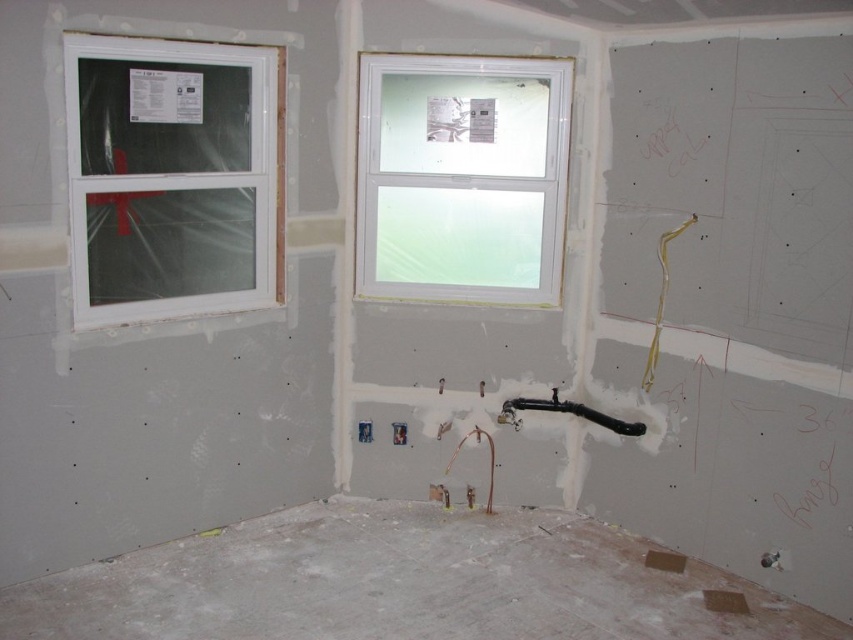
Is white plastic window at left above white plastic window at upper center?

Actually, white plastic window at left is below white plastic window at upper center.

Who is more distant from viewer, [209,234] or [401,93]?

Point [401,93]

Which is in front, point (161, 307) or point (428, 90)?

Point (161, 307) is in front.

This screenshot has height=640, width=853. What are the coordinates of `white plastic window at left` in the screenshot? It's located at (173, 177).

Can you confirm if white plastic window at left is positioned to the left of black rubber pipe at center?

Indeed, white plastic window at left is positioned on the left side of black rubber pipe at center.

Who is higher up, white plastic window at left or black rubber pipe at center?

white plastic window at left is higher up.

Does point (161, 212) come farther from viewer compared to point (519, 397)?

No, it is not.

You are a GUI agent. You are given a task and a screenshot of the screen. Output one action in this format:
    pyautogui.click(x=<x>, y=<y>)
    Task: Click on the white plastic window at left
    
    Given the screenshot: What is the action you would take?
    pyautogui.click(x=173, y=177)

Between white plastic window at upper center and black rubber pipe at center, which one is positioned higher?

Positioned higher is white plastic window at upper center.

Which is below, white plastic window at upper center or black rubber pipe at center?

black rubber pipe at center is below.

Is point (535, 150) more distant than point (578, 416)?

No, it is in front of (578, 416).

The image size is (853, 640). Identify the location of white plastic window at upper center. (461, 177).